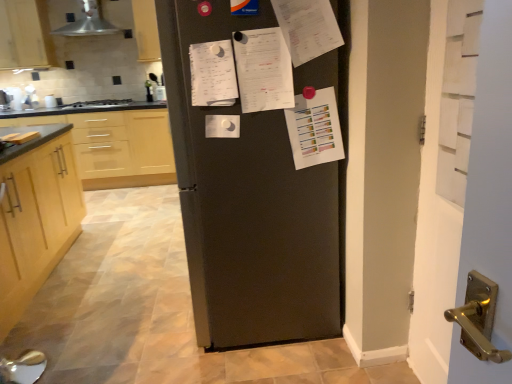
Question: Is metallic silver exhaust hood at upper left facing away from white painted wood door at right?

Choices:
 (A) no
 (B) yes

Answer: (A)

Question: From the image's perspective, would you say metallic silver exhaust hood at upper left is positioned over white painted wood door at right?

Choices:
 (A) no
 (B) yes

Answer: (B)

Question: Is white painted wood door at right surrounded by metallic silver exhaust hood at upper left?

Choices:
 (A) no
 (B) yes

Answer: (A)

Question: Are metallic silver exhaust hood at upper left and white painted wood door at right beside each other?

Choices:
 (A) yes
 (B) no

Answer: (B)

Question: Considering the relative positions of metallic silver exhaust hood at upper left and white painted wood door at right in the image provided, is metallic silver exhaust hood at upper left to the right of white painted wood door at right from the viewer's perspective?

Choices:
 (A) no
 (B) yes

Answer: (A)

Question: Visually, is white paper at center, placed as the second list when sorted from right to left, positioned to the left or to the right of light wood cabinet at left, arranged as the 3th cabinetry when viewed from the top?

Choices:
 (A) left
 (B) right

Answer: (B)

Question: From the image's perspective, is white paper at center, placed as the second list when sorted from right to left, located above or below light wood cabinet at left, the 1th cabinetry positioned from the bottom?

Choices:
 (A) above
 (B) below

Answer: (A)

Question: Is white paper at center, the 1th list positioned from the left, in front of or behind light wood cabinet at left, arranged as the 3th cabinetry when viewed from the top, in the image?

Choices:
 (A) front
 (B) behind

Answer: (A)

Question: Would you say white paper at center, placed as the second list when sorted from right to left, is inside or outside light wood cabinet at left, the 1th cabinetry positioned from the bottom?

Choices:
 (A) inside
 (B) outside

Answer: (B)

Question: From the image's perspective, is white painted wood door at right located above or below white paper at center, which appears as the 1th list when viewed from the right?

Choices:
 (A) below
 (B) above

Answer: (A)

Question: Looking at their shapes, would you say white painted wood door at right is wider or thinner than white paper at center, placed as the second list when sorted from left to right?

Choices:
 (A) wide
 (B) thin

Answer: (A)

Question: In the image, is white painted wood door at right positioned in front of or behind white paper at center, placed as the second list when sorted from left to right?

Choices:
 (A) front
 (B) behind

Answer: (A)

Question: From a real-world perspective, is white painted wood door at right physically located above or below white paper at center, which appears as the 1th list when viewed from the right?

Choices:
 (A) above
 (B) below

Answer: (B)

Question: Considering the positions of white painted wood door at right and light wood cabinet at left, the 1th cabinetry positioned from the bottom, in the image, is white painted wood door at right wider or thinner than light wood cabinet at left, the 1th cabinetry positioned from the bottom,?

Choices:
 (A) thin
 (B) wide

Answer: (A)

Question: From a real-world perspective, is white painted wood door at right physically located above or below light wood cabinet at left, the first cabinetry from the front?

Choices:
 (A) above
 (B) below

Answer: (A)